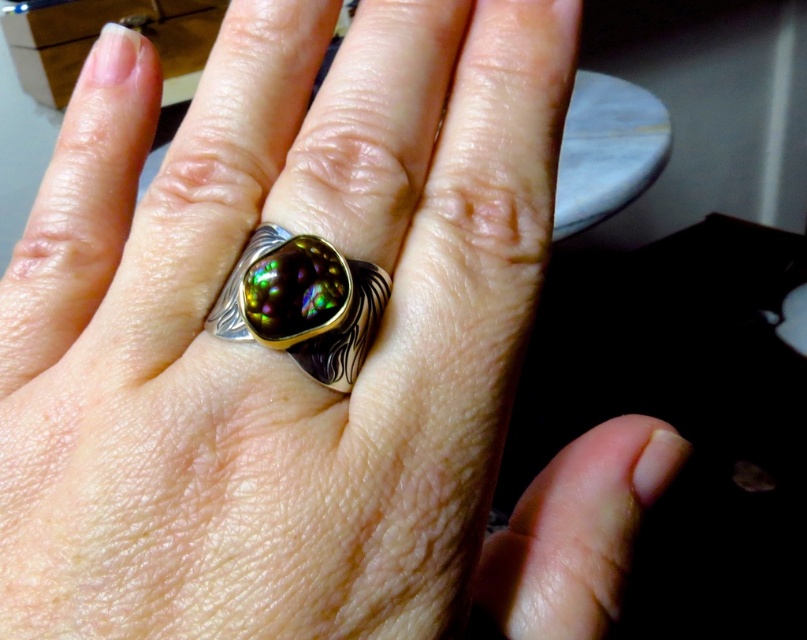
Question: Is silver/golden ring at center thinner than multicolored stone ring at center?

Choices:
 (A) no
 (B) yes

Answer: (A)

Question: Which object is farther from the camera taking this photo?

Choices:
 (A) multicolored stone ring at center
 (B) silver/golden ring at center

Answer: (A)

Question: In this image, where is silver/golden ring at center located relative to multicolored stone ring at center?

Choices:
 (A) below
 (B) above

Answer: (B)

Question: Can you confirm if silver/golden ring at center is positioned to the left of multicolored stone ring at center?

Choices:
 (A) yes
 (B) no

Answer: (A)